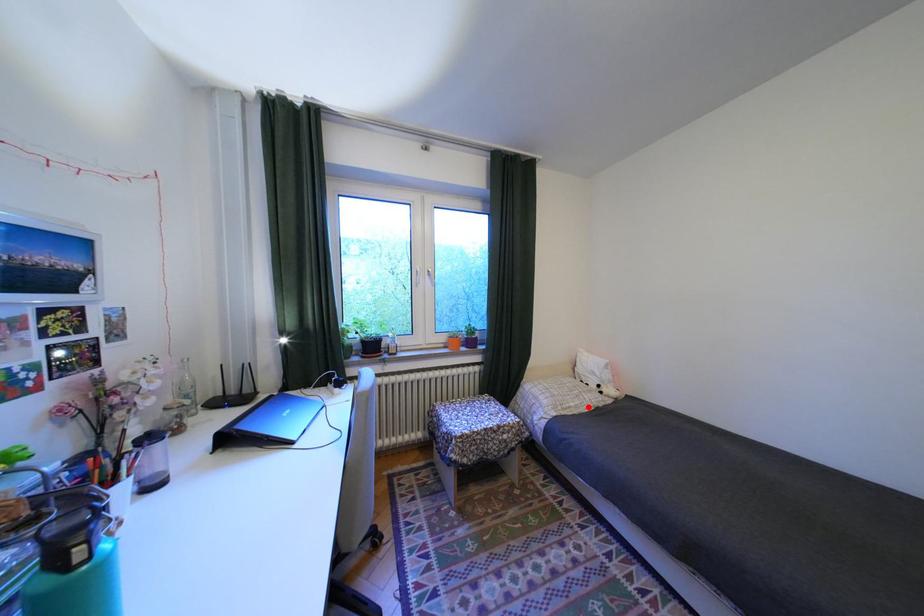
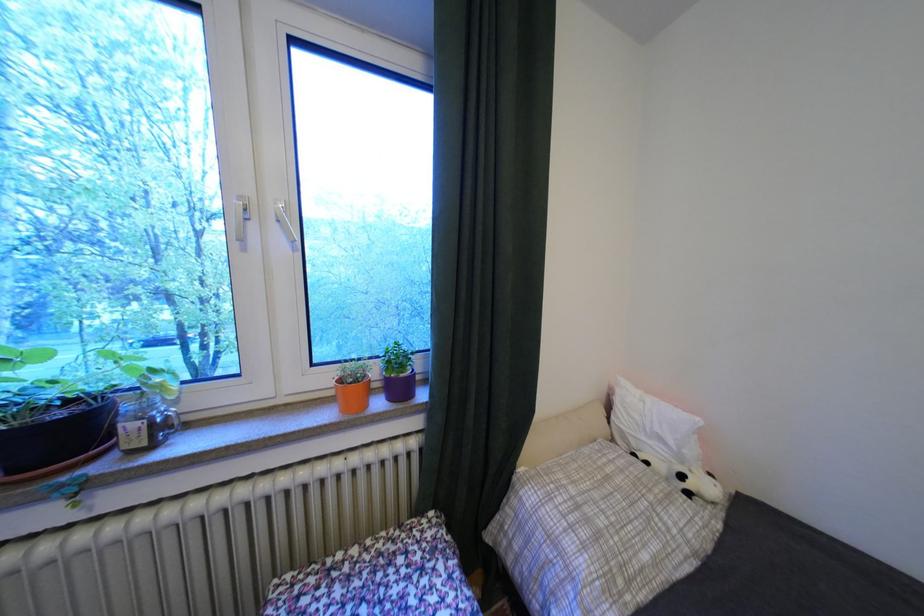
The point at the highlighted location is marked in the first image. Where is the corresponding point in the second image?

(667, 562)